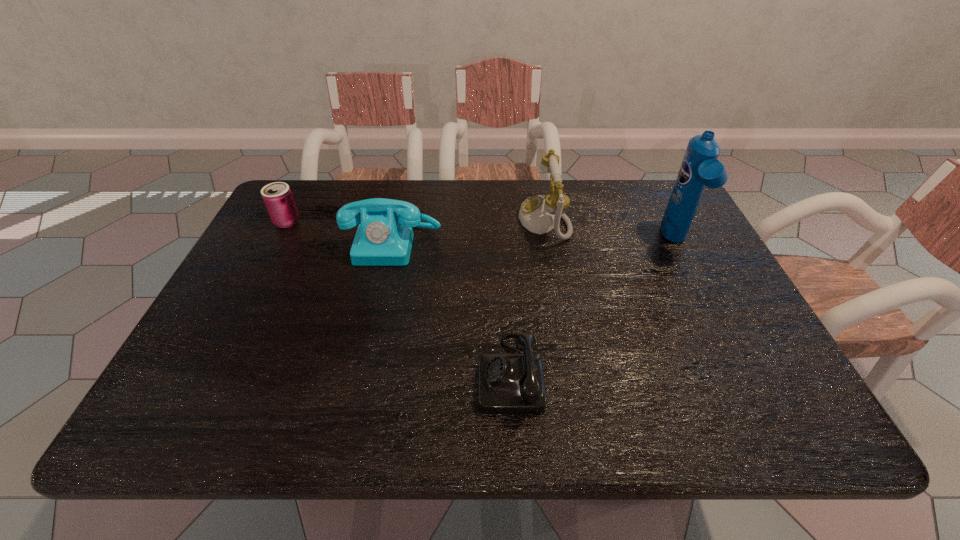
Where is `vacant region located on the dial of the fourth shortest object`? vacant region located on the dial of the fourth shortest object is located at coordinates (484, 220).

This screenshot has height=540, width=960. In order to click on vacant space located on the dial of the fourth shortest object in this screenshot , I will do `click(405, 220)`.

Find the location of a particular element. The image size is (960, 540). vacant space located 0.360m on the dial of the leftmost telephone is located at coordinates (361, 388).

Identify the location of free space located 0.340m on the front of the can. (234, 322).

In order to click on free space located on the dial of the shortest telephone in this screenshot , I will do `click(347, 373)`.

I want to click on blank space located 0.070m on the dial of the shortest telephone, so click(444, 373).

Find the location of a particular element. The width and height of the screenshot is (960, 540). free space located on the dial of the shortest telephone is located at coordinates (283, 373).

At what (x,y) coordinates should I click in order to perform the action: click on shampoo located in the far edge section of the desktop. Please return your answer as a coordinate pair (x, y). The height and width of the screenshot is (540, 960). Looking at the image, I should click on (700, 168).

This screenshot has width=960, height=540. Identify the location of can at the far edge. (277, 196).

Where is `object that is at the near edge`? The height and width of the screenshot is (540, 960). object that is at the near edge is located at coordinates (508, 383).